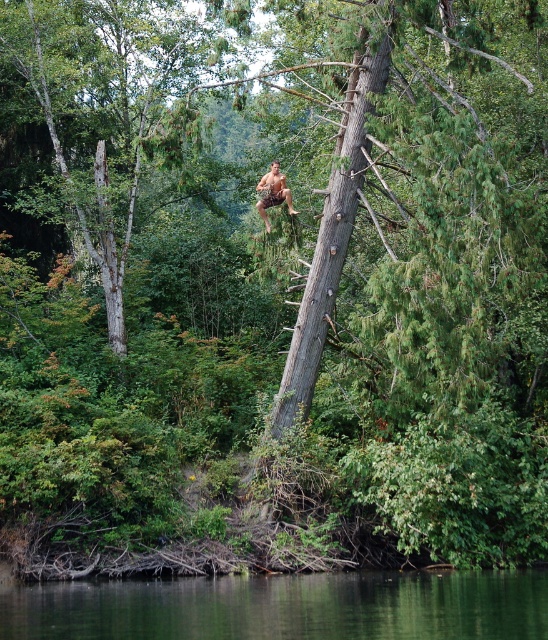
Is gray rough bark tree trunk at center bigger than brown textured shorts at center?

Yes.

Between gray rough bark tree trunk at center and brown textured shorts at center, which one has less height?

brown textured shorts at center is shorter.

Who is more forward, (334, 193) or (259, 205)?

Point (334, 193) is more forward.

At what (x,y) coordinates should I click in order to perform the action: click on gray rough bark tree trunk at center. Please return your answer as a coordinate pair (x, y). Looking at the image, I should click on (333, 228).

What do you see at coordinates (284, 605) in the screenshot?
I see `green liquid water at lower center` at bounding box center [284, 605].

Is green liquid water at lower center shorter than brown textured shorts at center?

Yes.

Is point (162, 632) positioned before point (278, 172)?

Yes, it is.

Where is `green liquid water at lower center`? green liquid water at lower center is located at coordinates (284, 605).

Find the location of `green liquid water at lower center`. green liquid water at lower center is located at coordinates (284, 605).

Between green liquid water at lower center and gray rough bark tree trunk at center, which one is positioned lower?

green liquid water at lower center is lower down.

Does point (14, 600) come in front of point (312, 314)?

Yes.

Locate an element on the screen. This screenshot has height=640, width=548. green liquid water at lower center is located at coordinates (284, 605).